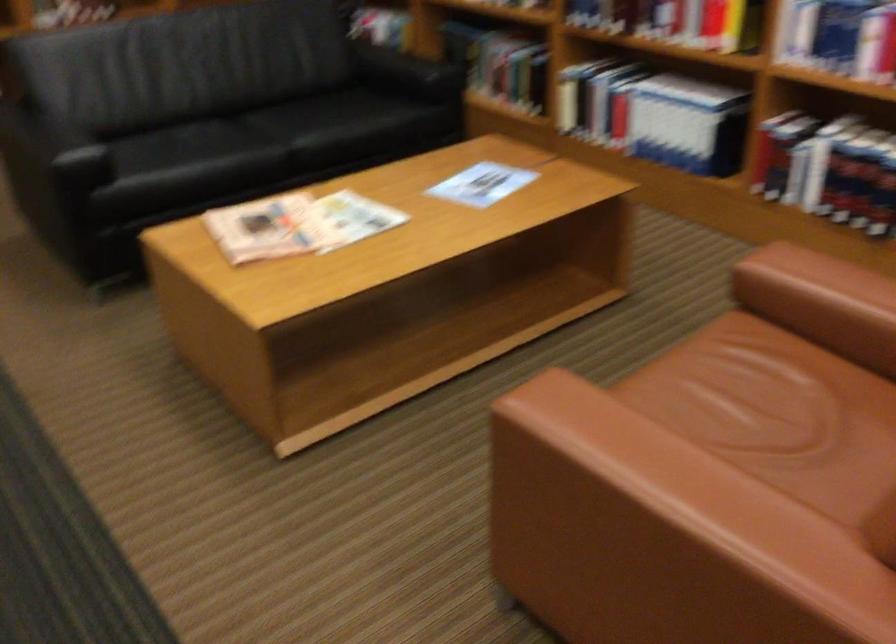
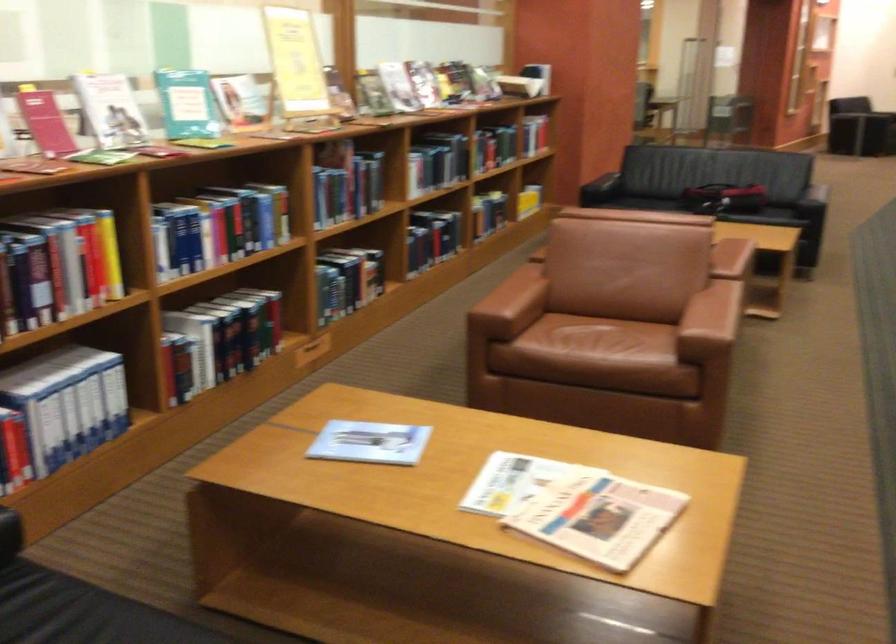
Where in the second image is the point corresponding to the point at 702,415 from the first image?

(599, 342)